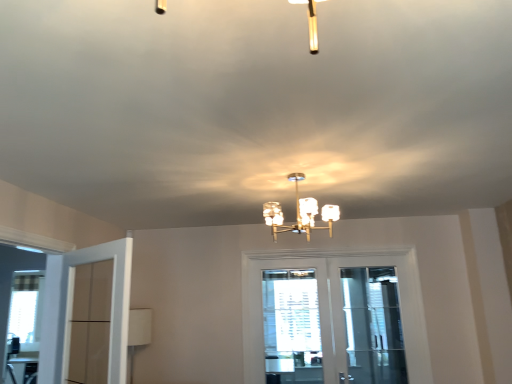
Question: Is matte glass chandelier at center further to camera compared to clear glass screen door at center?

Choices:
 (A) yes
 (B) no

Answer: (B)

Question: Is matte glass chandelier at center wider than clear glass screen door at center?

Choices:
 (A) yes
 (B) no

Answer: (A)

Question: Considering the relative positions of matte glass chandelier at center and clear glass screen door at center in the image provided, is matte glass chandelier at center to the right of clear glass screen door at center from the viewer's perspective?

Choices:
 (A) yes
 (B) no

Answer: (B)

Question: From the image's perspective, would you say matte glass chandelier at center is positioned over clear glass screen door at center?

Choices:
 (A) yes
 (B) no

Answer: (A)

Question: Would you consider matte glass chandelier at center to be distant from clear glass screen door at center?

Choices:
 (A) yes
 (B) no

Answer: (B)

Question: From the image's perspective, is matte glass chandelier at center located above or below white textured window at center?

Choices:
 (A) above
 (B) below

Answer: (A)

Question: In the image, is matte glass chandelier at center positioned in front of or behind white textured window at center?

Choices:
 (A) behind
 (B) front

Answer: (B)

Question: Is matte glass chandelier at center to the left or to the right of white textured window at center in the image?

Choices:
 (A) right
 (B) left

Answer: (B)

Question: Looking at their shapes, would you say matte glass chandelier at center is wider or thinner than white textured window at center?

Choices:
 (A) thin
 (B) wide

Answer: (B)

Question: From a real-world perspective, relative to white matte door at left, the second door positioned from the back, is matte glass chandelier at center vertically above or below?

Choices:
 (A) below
 (B) above

Answer: (B)

Question: In the image, is matte glass chandelier at center positioned in front of or behind white matte door at left, arranged as the 1th door when viewed from the left?

Choices:
 (A) behind
 (B) front

Answer: (B)

Question: Considering the positions of matte glass chandelier at center and white matte door at left, the second door positioned from the back, in the image, is matte glass chandelier at center wider or thinner than white matte door at left, the second door positioned from the back,?

Choices:
 (A) thin
 (B) wide

Answer: (B)

Question: Would you say matte glass chandelier at center is inside or outside white matte door at left, which is counted as the 1th door, starting from the front?

Choices:
 (A) outside
 (B) inside

Answer: (A)

Question: Considering their positions, is white matte door at left, the 2th door viewed from the right, located in front of or behind clear glass screen door at center?

Choices:
 (A) front
 (B) behind

Answer: (A)

Question: In terms of height, does white matte door at left, the second door positioned from the back, look taller or shorter compared to clear glass screen door at center?

Choices:
 (A) tall
 (B) short

Answer: (B)